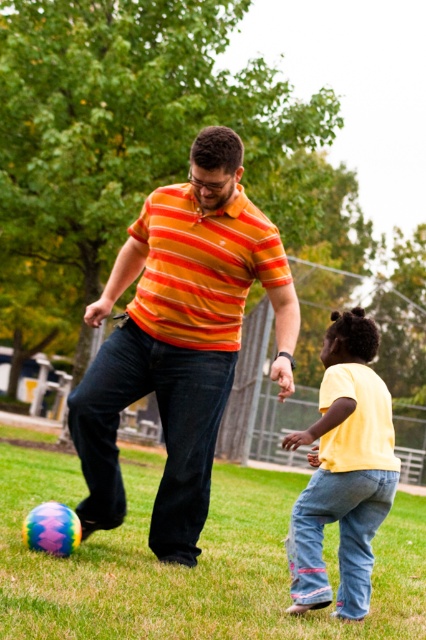
This screenshot has width=426, height=640. What do you see at coordinates (180, 339) in the screenshot? I see `orange striped shirt at center` at bounding box center [180, 339].

This screenshot has height=640, width=426. I want to click on orange striped shirt at center, so click(180, 339).

Identify the location of orange striped shirt at center. (180, 339).